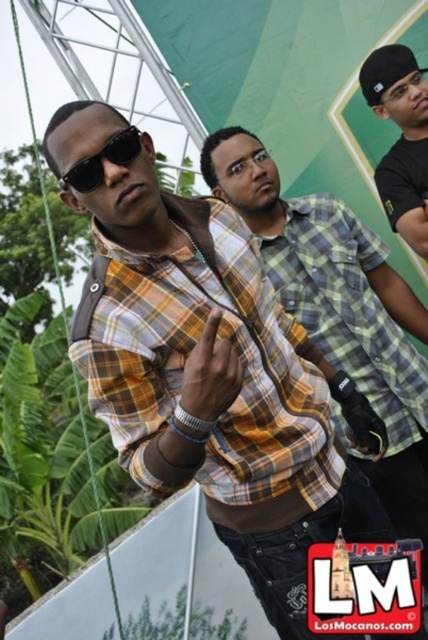
You are a photographer standing at the edge of the scene. You want to take a photo that includes both the yellow plaid shirt at center and the black matte cap at upper right. What is the minimum distance you should move forward to ensure both are in frame?

The minimum distance you should move forward is 1.25 meters to ensure both the yellow plaid shirt at center and the black matte cap at upper right are in frame.

You are standing at the origin point of the coordinate system where the image is displayed. You see a yellow plaid shirt at center marked by point (x=190, y=353). If you move 0.1 units to the right along the x axis, will you be closer to or farther from the yellow plaid shirt at center?

Moving 0.1 units to the right along the x axis from the origin point would take you to the coordinate point 0.1, 0. Since the yellow plaid shirt at center is marked at (x=190, y=353), moving right along the x axis increases your x coordinate but keeps the y coordinate the same. The distance between two points can be calculated using the distance formula. The original distance from the origin to the shirt is sqrt0.552 squared plus 0.444 squared. After moving right, the new distance is sqrt of 0.652 squared 0.4

You are a photographer trying to capture a candid shot of the yellow plaid shirt at center and the black matte sunglasses at center. Since you want to ensure both are in focus, which object should you focus on first to maintain clarity?

The yellow plaid shirt at center is positioned under black matte sunglasses at center, so you should focus on the black matte sunglasses at center first as it is closer to the camera.